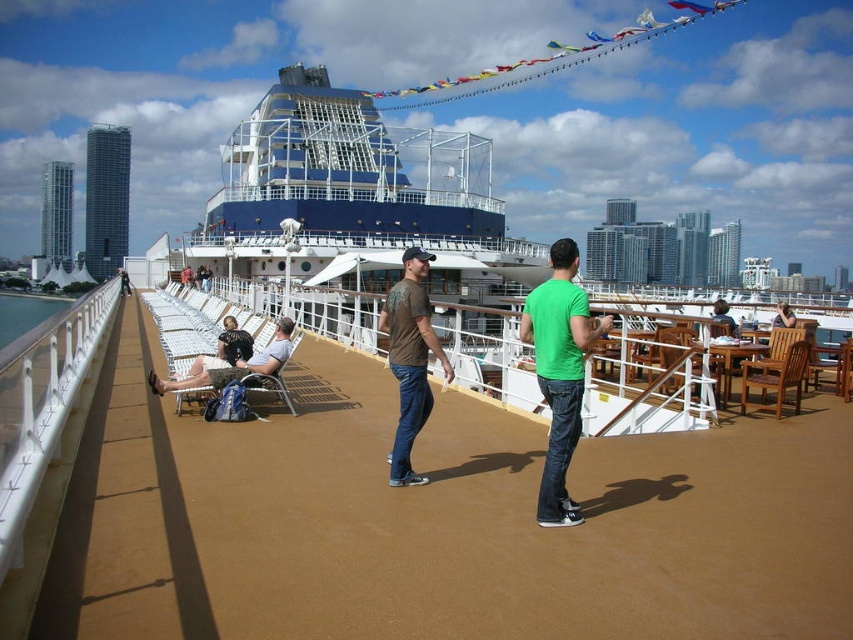
You are standing on the deck of the cruise ship and want to reach the point marked as point (555, 316). Considering the deck is 100 feet long, will you have to walk the entire length of the deck to get there?

The point (555, 316) is 86.44 feet away from the viewer, which is less than the deck length of 100 feet. Therefore, you won not have to walk the entire length of the deck to reach it.